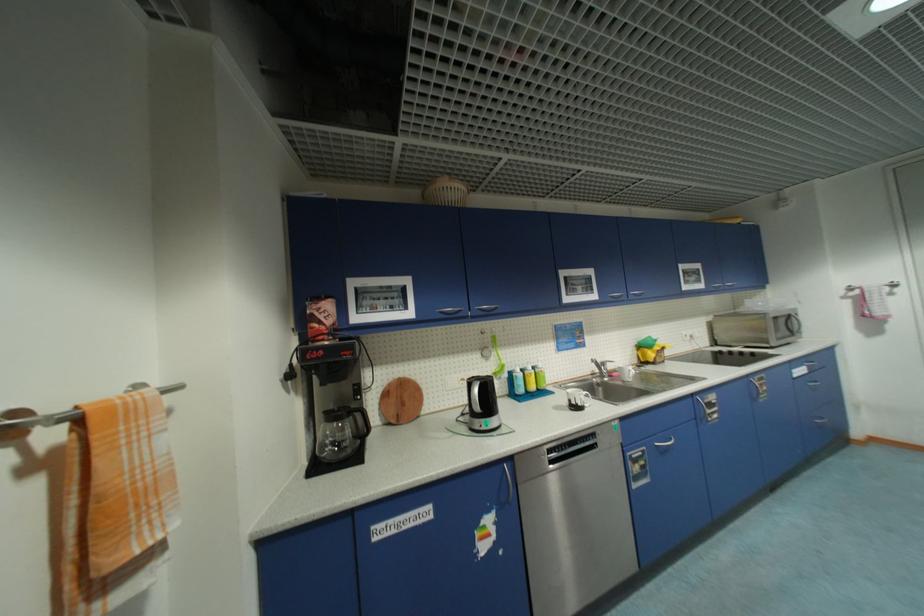
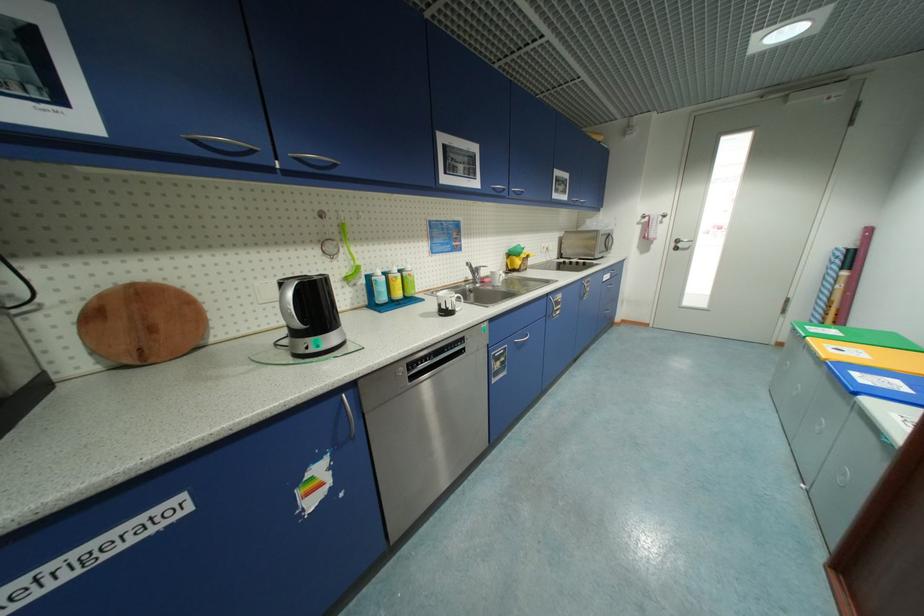
Where in the second image is the point corresponding to point 586,406 from the first image?

(456, 310)